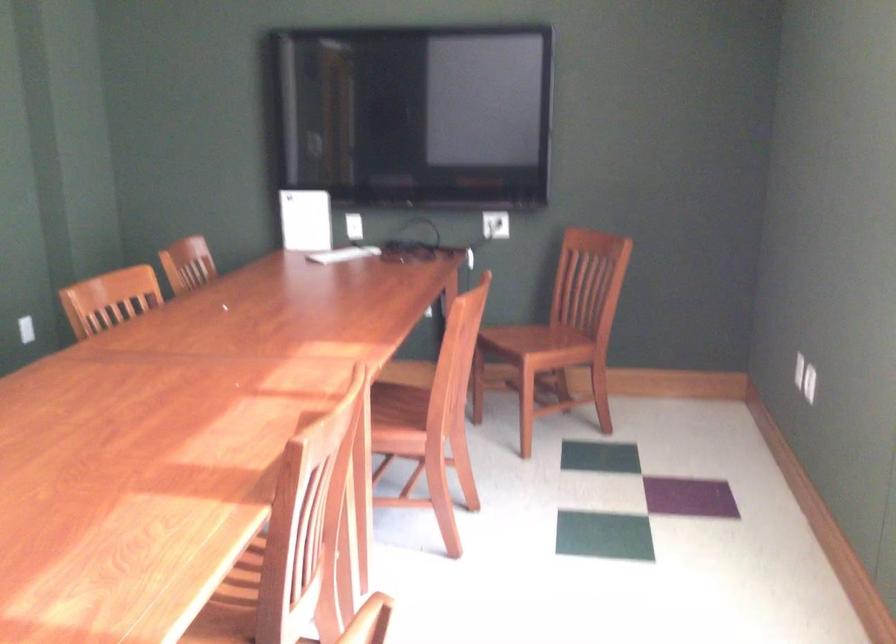
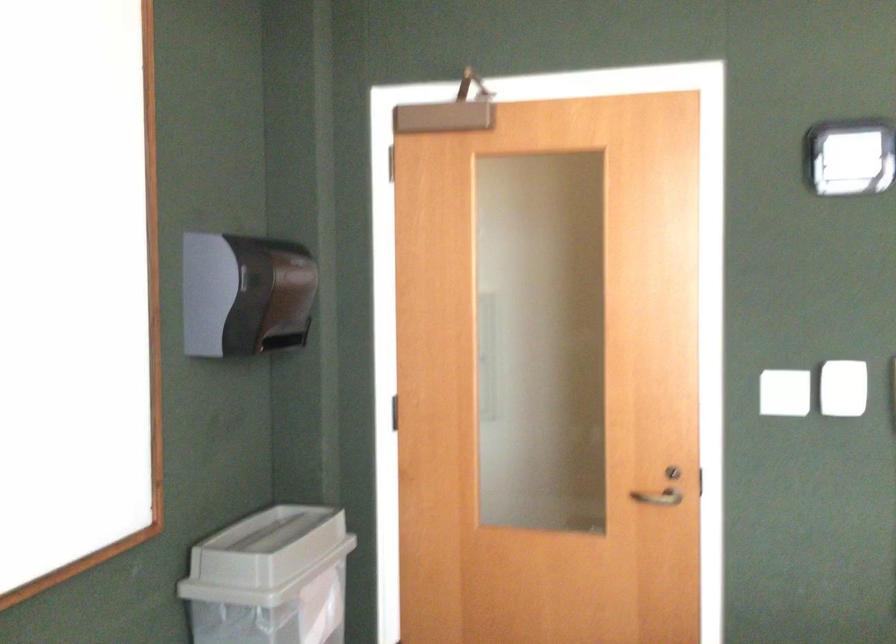
Question: How did the camera likely rotate?

Choices:
 (A) Left
 (B) Right
 (C) Up
 (D) Down

Answer: (A)